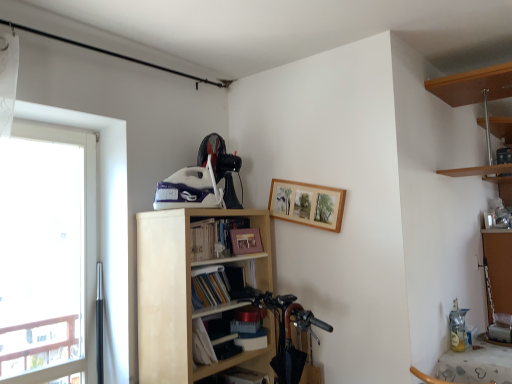
Question: Is there a large distance between shiny black mountain bike at lower center and matte paper book at center, marked as the first book in a bottom-to-top arrangement?

Choices:
 (A) no
 (B) yes

Answer: (A)

Question: Is shiny black mountain bike at lower center behind matte paper book at center, the 2th book positioned from the top?

Choices:
 (A) yes
 (B) no

Answer: (A)

Question: Considering the relative sizes of shiny black mountain bike at lower center and matte paper book at center, the 2th book positioned from the top, in the image provided, is shiny black mountain bike at lower center thinner than matte paper book at center, the 2th book positioned from the top,?

Choices:
 (A) no
 (B) yes

Answer: (B)

Question: Considering the relative positions of shiny black mountain bike at lower center and matte paper book at center, the 2th book positioned from the top, in the image provided, is shiny black mountain bike at lower center to the left of matte paper book at center, the 2th book positioned from the top, from the viewer's perspective?

Choices:
 (A) yes
 (B) no

Answer: (B)

Question: Can you confirm if shiny black mountain bike at lower center is shorter than matte paper book at center, the 2th book positioned from the top?

Choices:
 (A) no
 (B) yes

Answer: (A)

Question: From a real-world perspective, is wooden picture frame at upper center, which is counted as the 2th picture frame, starting from the left, physically located above or below light wood bookshelf at center?

Choices:
 (A) below
 (B) above

Answer: (B)

Question: Considering the positions of wooden picture frame at upper center, the second picture frame positioned from the bottom, and light wood bookshelf at center in the image, is wooden picture frame at upper center, the second picture frame positioned from the bottom, bigger or smaller than light wood bookshelf at center?

Choices:
 (A) small
 (B) big

Answer: (A)

Question: In terms of height, does wooden picture frame at upper center, which appears as the 1th picture frame when viewed from the top, look taller or shorter compared to light wood bookshelf at center?

Choices:
 (A) short
 (B) tall

Answer: (A)

Question: From the image's perspective, is wooden picture frame at upper center, which is counted as the 2th picture frame, starting from the left, positioned above or below light wood bookshelf at center?

Choices:
 (A) above
 (B) below

Answer: (A)

Question: In terms of height, does transparent glass window at left look taller or shorter compared to hardcover book at center, which appears as the 1th book when viewed from the top?

Choices:
 (A) short
 (B) tall

Answer: (B)

Question: Considering the positions of transparent glass window at left and hardcover book at center, which appears as the 1th book when viewed from the top, in the image, is transparent glass window at left bigger or smaller than hardcover book at center, which appears as the 1th book when viewed from the top,?

Choices:
 (A) big
 (B) small

Answer: (A)

Question: From the image's perspective, is transparent glass window at left positioned above or below hardcover book at center, the 2th book ordered from the bottom?

Choices:
 (A) below
 (B) above

Answer: (A)

Question: In the image, is transparent glass window at left positioned in front of or behind hardcover book at center, the 2th book ordered from the bottom?

Choices:
 (A) front
 (B) behind

Answer: (A)

Question: Is point (247, 228) positioned closer to the camera than point (219, 292)?

Choices:
 (A) closer
 (B) farther

Answer: (B)

Question: Is wooden picture frame at upper center, which is counted as the first picture frame, starting from the bottom, bigger or smaller than matte paper book at center, marked as the first book in a bottom-to-top arrangement?

Choices:
 (A) small
 (B) big

Answer: (A)